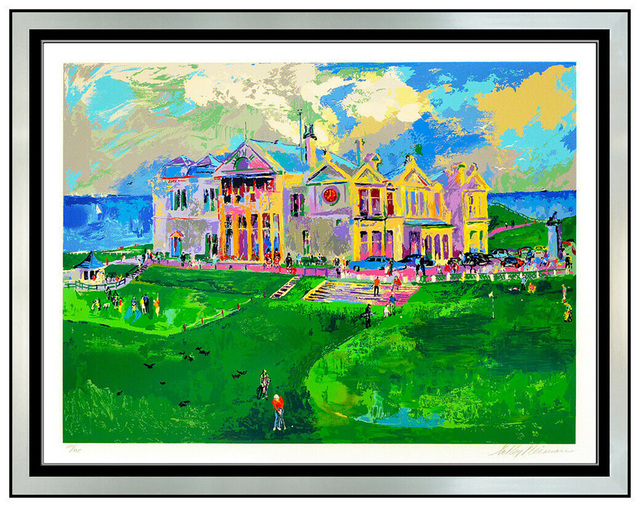
In order to click on chimney in this screenshot , I will do `click(308, 146)`.